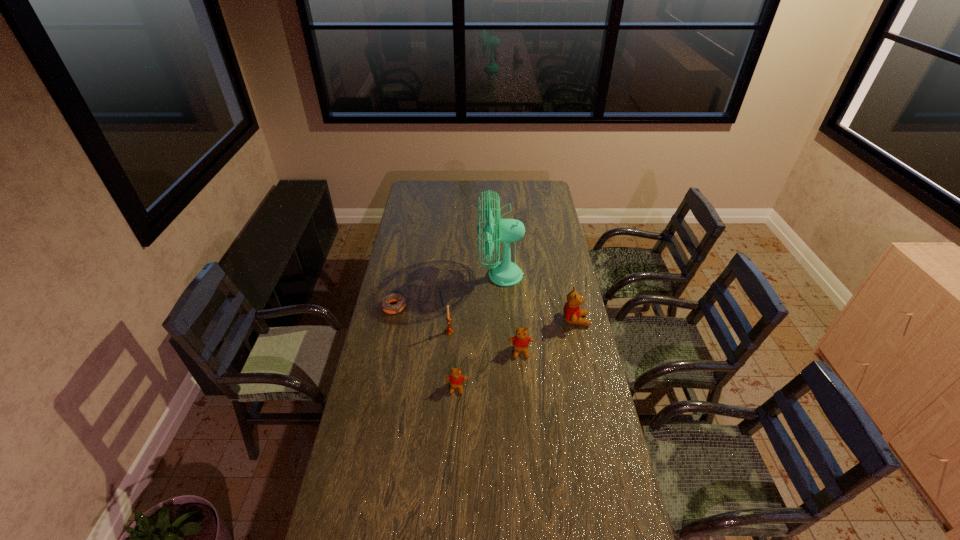
You are a GUI agent. You are given a task and a screenshot of the screen. Output one action in this format:
    pyautogui.click(x=<x>, y=<y>)
    Task: Click on the free space at the left edge of the desktop
    The height and width of the screenshot is (540, 960).
    Given the screenshot: What is the action you would take?
    pyautogui.click(x=346, y=506)

This screenshot has height=540, width=960. What are the coordinates of `vacant space at the right edge of the desktop` in the screenshot? It's located at (561, 346).

Locate an element on the screen. The height and width of the screenshot is (540, 960). free space at the far right corner of the desktop is located at coordinates (545, 199).

Find the location of `vacant region at the near right corner of the desktop`. vacant region at the near right corner of the desktop is located at coordinates (605, 535).

At what (x,y) coordinates should I click in order to perform the action: click on empty space that is in between the shortest object and the candle_holder. Please return your answer as a coordinate pair (x, y). Looking at the image, I should click on (421, 319).

The width and height of the screenshot is (960, 540). Find the location of `unoccupied position between the leftmost teddy bear and the second tallest teddy bear`. unoccupied position between the leftmost teddy bear and the second tallest teddy bear is located at coordinates (489, 369).

Locate an element on the screen. The height and width of the screenshot is (540, 960). free spot between the fan and the candle_holder is located at coordinates (475, 303).

I want to click on vacant region between the fan and the nearest teddy bear, so click(x=478, y=332).

At what (x,y) coordinates should I click in order to perform the action: click on free space between the tallest object and the tallest teddy bear. Please return your answer as a coordinate pair (x, y). Looking at the image, I should click on [538, 298].

The image size is (960, 540). Find the location of `unoccupied area between the fan and the rightmost teddy bear`. unoccupied area between the fan and the rightmost teddy bear is located at coordinates (x=538, y=298).